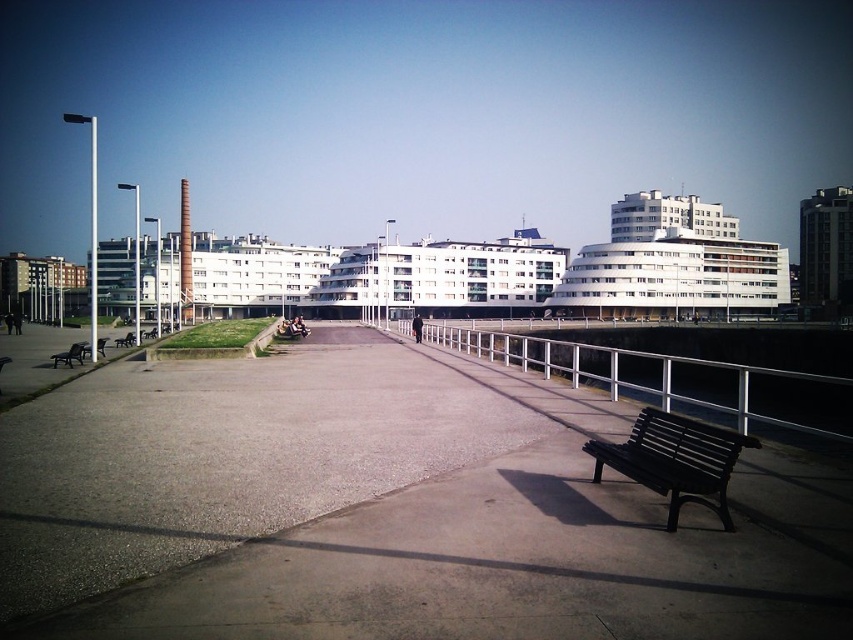
Which is below, gray concrete pavement at center or white metal rail at center?

white metal rail at center is below.

This screenshot has width=853, height=640. I want to click on gray concrete pavement at center, so click(389, 509).

How far apart are gray concrete pavement at center and matte black bench at left?

gray concrete pavement at center and matte black bench at left are 13.12 meters apart from each other.

Which is in front, point (782, 609) or point (61, 355)?

Point (782, 609)

Consider the image. Who is more distant from viewer, (251,556) or (57,356)?

Point (57,356)

Identify the location of gray concrete pavement at center. The image size is (853, 640). (389, 509).

Is white metal rail at center shorter than dark brown wooden bench at lower right?

No, white metal rail at center is not shorter than dark brown wooden bench at lower right.

From the picture: Between white metal rail at center and dark brown wooden bench at lower right, which one has more height?

Standing taller between the two is white metal rail at center.

Which is behind, point (727, 394) or point (645, 481)?

Point (727, 394)

I want to click on white metal rail at center, so click(663, 378).